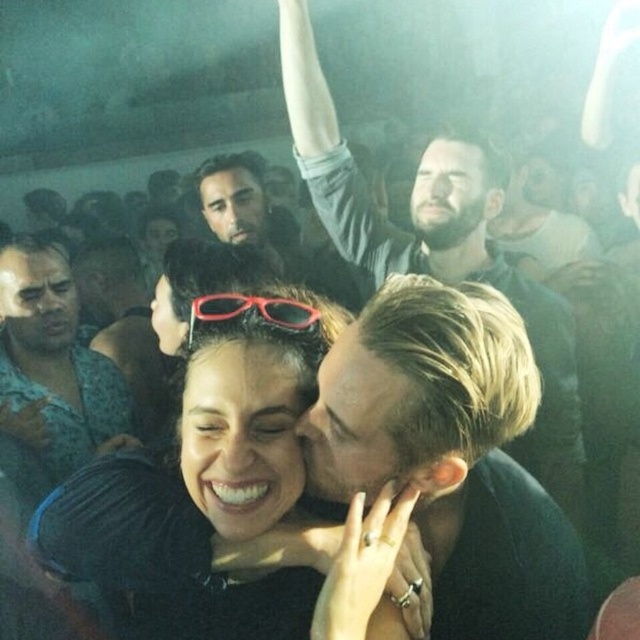
Question: Does matte black sunglasses at center have a lesser width compared to brushed metal shirt at center?

Choices:
 (A) no
 (B) yes

Answer: (A)

Question: Does blonde hair at center have a larger size compared to matte black sunglasses at center?

Choices:
 (A) no
 (B) yes

Answer: (A)

Question: Which object appears closest to the camera in this image?

Choices:
 (A) rubberized plastic glasses at center
 (B) matte black shirt at upper center

Answer: (A)

Question: Which point is farther to the camera?

Choices:
 (A) (481, 465)
 (B) (557, 433)
 (C) (314, 365)
 (D) (80, 428)

Answer: (D)

Question: Can you confirm if blonde hair at center is positioned to the right of rubberized plastic glasses at center?

Choices:
 (A) yes
 (B) no

Answer: (A)

Question: Which point appears farthest from the camera in this image?

Choices:
 (A) (307, 250)
 (B) (108, 429)
 (C) (236, 294)

Answer: (A)